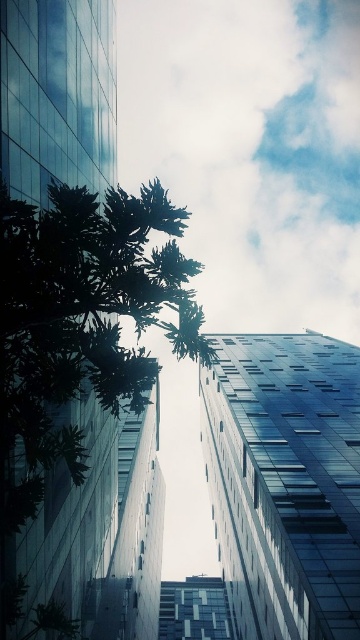
Question: Where is white fluffy cloud at upper center located in relation to green leafy tree at center in the image?

Choices:
 (A) below
 (B) above

Answer: (B)

Question: Which of the following is the farthest from the observer?

Choices:
 (A) white fluffy cloud at upper center
 (B) green leafy tree at center

Answer: (A)

Question: Can you confirm if white fluffy cloud at upper center is smaller than green leafy tree at center?

Choices:
 (A) no
 (B) yes

Answer: (A)

Question: Is white fluffy cloud at upper center to the right of green leafy tree at center from the viewer's perspective?

Choices:
 (A) no
 (B) yes

Answer: (B)

Question: Which point is farther from the camera taking this photo?

Choices:
 (A) (218, 196)
 (B) (83, 452)

Answer: (A)

Question: Which point is closer to the camera?

Choices:
 (A) (348, 308)
 (B) (29, 312)

Answer: (B)